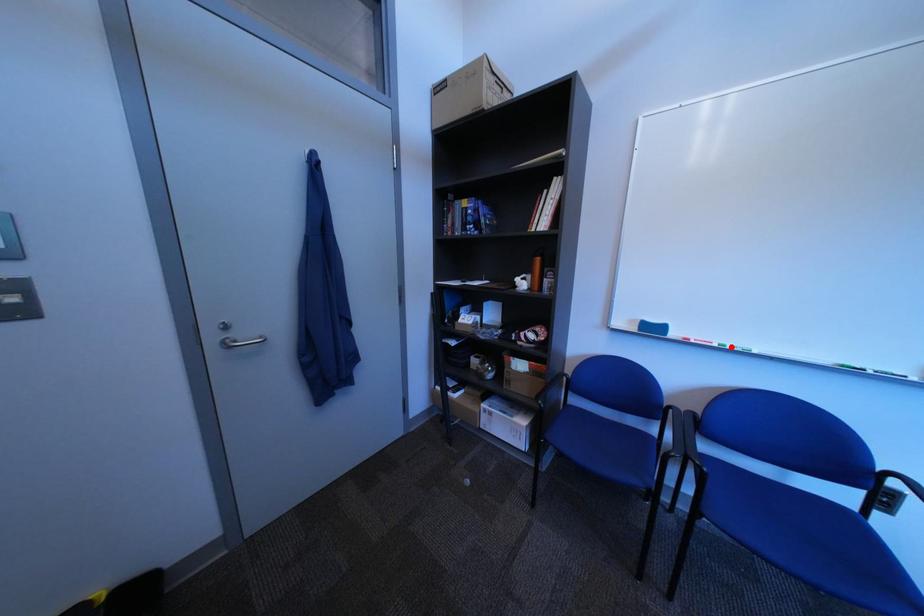
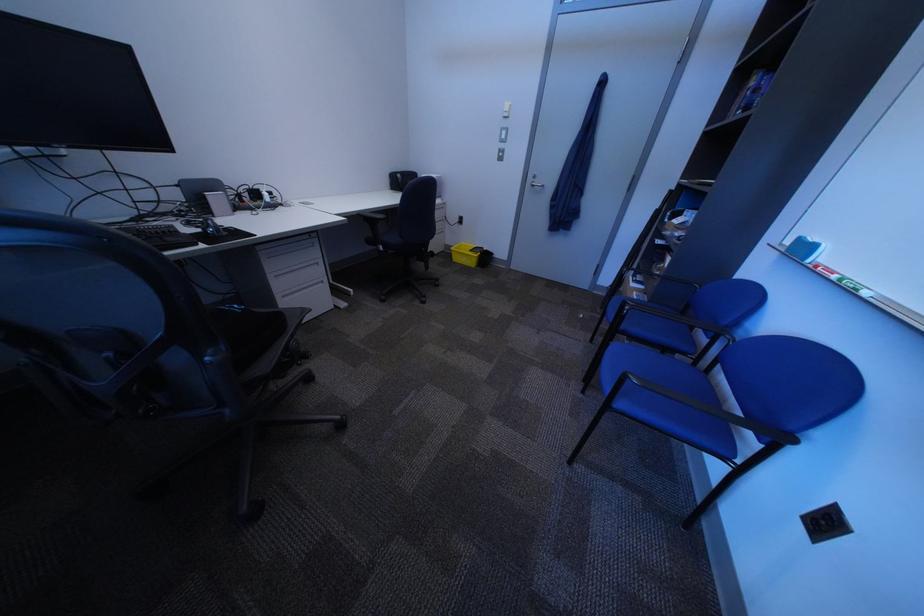
Where in the second image is the point corresponding to the highlighted location from the first image?

(849, 278)